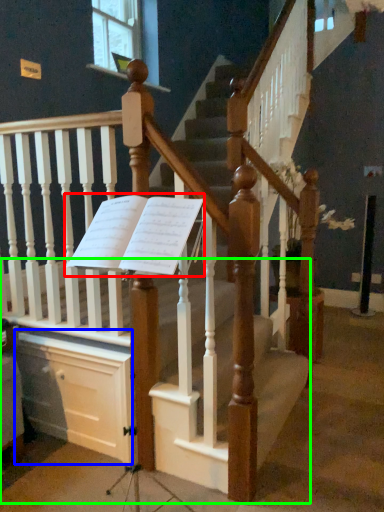
Question: Which object is the farthest from sheet music (highlighted by a red box)? Choose among these: drawer (highlighted by a blue box) or stairs (highlighted by a green box).

Choices:
 (A) drawer
 (B) stairs

Answer: (A)